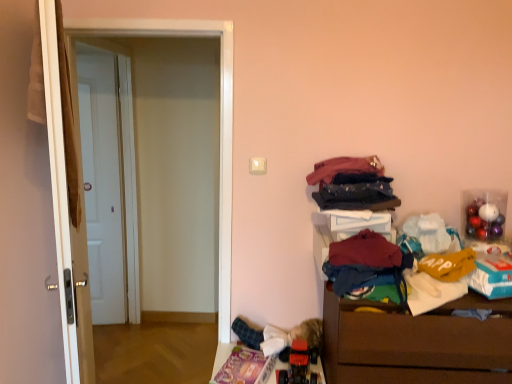
Question: From the image's perspective, is white matte door at left, the first door from the back, located beneath dark blue denim jeans at upper right, positioned as the third clothing in bottom-to-top order?

Choices:
 (A) yes
 (B) no

Answer: (A)

Question: Is white matte door at left, which appears as the 1th door when viewed from the left, touching dark blue denim jeans at upper right, which is the 1th clothing from top to bottom?

Choices:
 (A) no
 (B) yes

Answer: (A)

Question: Is white matte door at left, the second door positioned from the right, located outside dark blue denim jeans at upper right, which is the 1th clothing from top to bottom?

Choices:
 (A) no
 (B) yes

Answer: (B)

Question: Considering the relative sizes of white matte door at left, which appears as the 1th door when viewed from the left, and dark blue denim jeans at upper right, which is the 1th clothing from top to bottom, in the image provided, is white matte door at left, which appears as the 1th door when viewed from the left, thinner than dark blue denim jeans at upper right, which is the 1th clothing from top to bottom,?

Choices:
 (A) yes
 (B) no

Answer: (A)

Question: Does white matte door at left, which appears as the 1th door when viewed from the left, turn towards dark blue denim jeans at upper right, positioned as the third clothing in bottom-to-top order?

Choices:
 (A) yes
 (B) no

Answer: (B)

Question: From a real-world perspective, is white matte door at left, the first door from the back, on dark blue denim jeans at upper right, positioned as the third clothing in bottom-to-top order?

Choices:
 (A) no
 (B) yes

Answer: (A)

Question: Is dark blue fabric at upper right, the second clothing ordered from the bottom, positioned with its back to white glossy door at left, the second door when ordered from left to right?

Choices:
 (A) no
 (B) yes

Answer: (A)

Question: Is dark blue fabric at upper right, the second clothing ordered from the bottom, to the right of white glossy door at left, acting as the 1th door starting from the front, from the viewer's perspective?

Choices:
 (A) yes
 (B) no

Answer: (A)

Question: Does dark blue fabric at upper right, positioned as the 2th clothing in top-to-bottom order, appear on the left side of white glossy door at left, arranged as the second door when viewed from the back?

Choices:
 (A) no
 (B) yes

Answer: (A)

Question: From a real-world perspective, is dark blue fabric at upper right, the second clothing ordered from the bottom, physically below white glossy door at left, the second door when ordered from left to right?

Choices:
 (A) yes
 (B) no

Answer: (B)

Question: Is dark blue fabric at upper right, positioned as the 2th clothing in top-to-bottom order, located outside white glossy door at left, acting as the 1th door starting from the front?

Choices:
 (A) yes
 (B) no

Answer: (A)

Question: Is dark blue fabric at upper right, the second clothing ordered from the bottom, positioned far away from white glossy door at left, the 1th door in the right-to-left sequence?

Choices:
 (A) no
 (B) yes

Answer: (B)

Question: From the image's perspective, would you say dark red fabric at lower right, arranged as the third clothing when viewed from the top, is positioned over white glossy door at left, acting as the 1th door starting from the front?

Choices:
 (A) yes
 (B) no

Answer: (B)